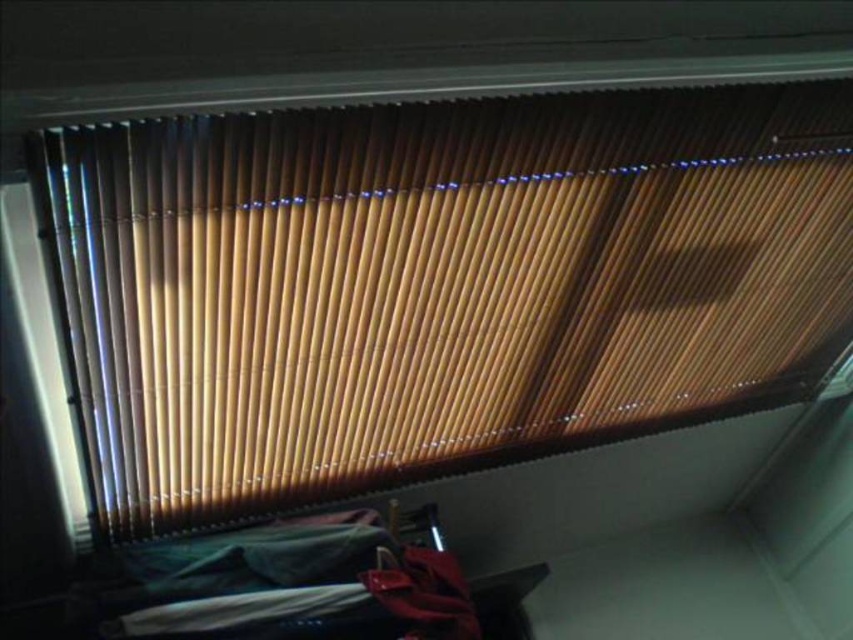
Question: Among these objects, which one is nearest to the camera?

Choices:
 (A) velvet green bed at lower center
 (B) wooden blinds at upper center

Answer: (B)

Question: Does wooden blinds at upper center have a greater width compared to velvet green bed at lower center?

Choices:
 (A) no
 (B) yes

Answer: (B)

Question: Which of the following is the farthest from the observer?

Choices:
 (A) velvet green bed at lower center
 (B) wooden blinds at upper center

Answer: (A)

Question: Does wooden blinds at upper center have a greater width compared to velvet green bed at lower center?

Choices:
 (A) no
 (B) yes

Answer: (B)

Question: Is wooden blinds at upper center closer to the viewer compared to velvet green bed at lower center?

Choices:
 (A) yes
 (B) no

Answer: (A)